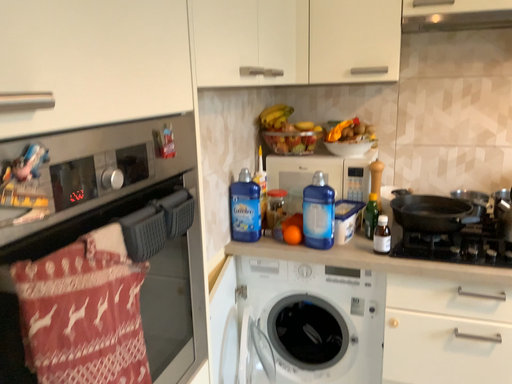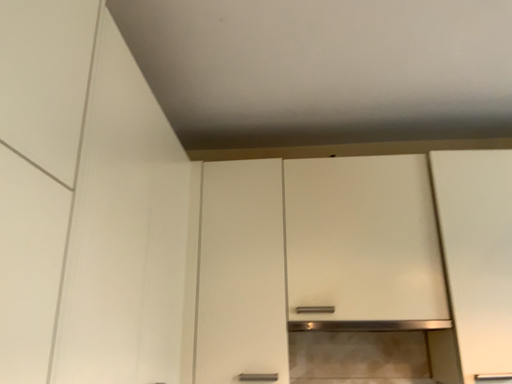
Question: Which way did the camera rotate in the video?

Choices:
 (A) rotated downward
 (B) rotated upward

Answer: (B)